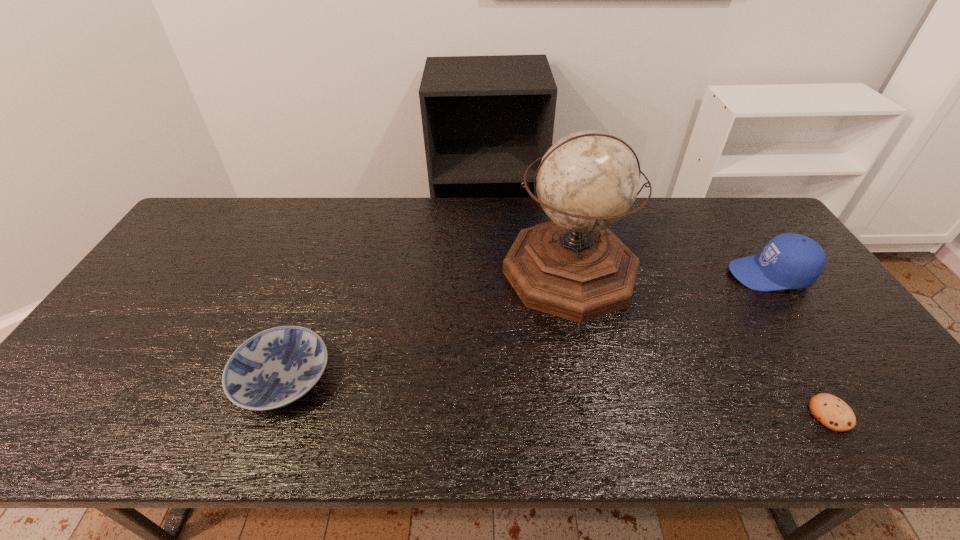
I want to click on vacant region located on the back of the second shortest object, so click(326, 263).

Find the location of a particular element. vacant area situated 0.400m on the left of the shortest object is located at coordinates (634, 414).

Locate an element on the screen. The image size is (960, 540). object at the far edge is located at coordinates coord(573,267).

This screenshot has height=540, width=960. Find the location of `plate situated at the near edge`. plate situated at the near edge is located at coordinates (274, 368).

Where is `cookie that is at the near edge`? cookie that is at the near edge is located at coordinates (832, 412).

Identify the location of cap situated at the right edge. The image size is (960, 540). (788, 261).

Locate an element on the screen. This screenshot has width=960, height=540. cookie located at the right edge is located at coordinates (832, 412).

Image resolution: width=960 pixels, height=540 pixels. In order to click on object located at the near right corner in this screenshot , I will do `click(832, 412)`.

At what (x,y) coordinates should I click in order to perform the action: click on vacant region at the far edge. Please return your answer as a coordinate pair (x, y). This screenshot has width=960, height=540. Looking at the image, I should click on (269, 210).

The image size is (960, 540). In order to click on free space at the near edge of the desktop in this screenshot , I will do `click(430, 417)`.